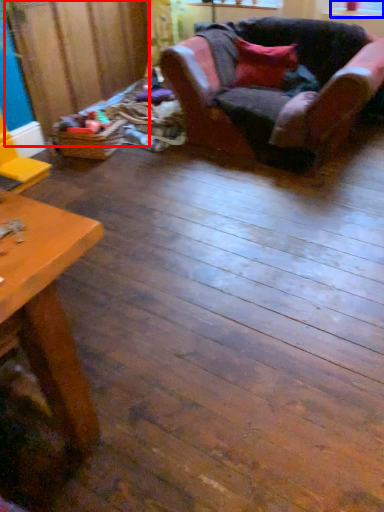
Question: Which point is further to the camera, plywood (highlighted by a red box) or window screen (highlighted by a blue box)?

Choices:
 (A) plywood
 (B) window screen

Answer: (B)